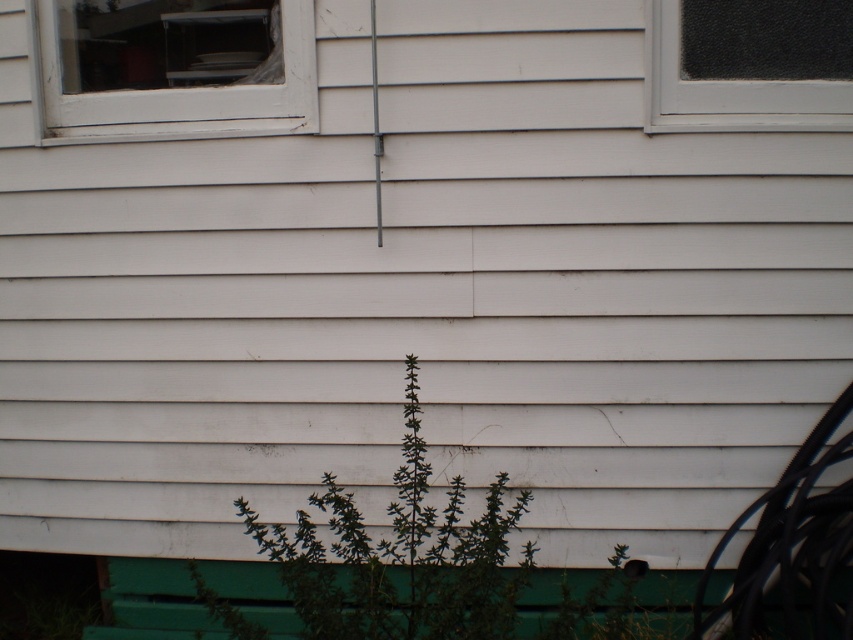
You are standing in front of the house wall and see two points marked on the wall. The first point is at position point [294,636] and the second is at point [759,100]. Which point is closer to you?

Point [759,100] is closer to you because it is in front of point [294,636].

You are standing in front of the house exterior and want to place a new flower pot between the green painted wood park bench at lower center and the clear glass window at upper right. Based on their positions, where should you place the flower pot to ensure it is between them?

The green painted wood park bench at lower center is positioned on the left side of the clear glass window at upper right, so placing the flower pot to the right of the bench and to the left of the window would position it between them.

You are standing in front of the house and notice the green leafy plant at center and the green painted wood park bench at lower center. Which object is located higher up on the wall?

The green leafy plant at center is positioned over the green painted wood park bench at lower center, so it is higher up on the wall.